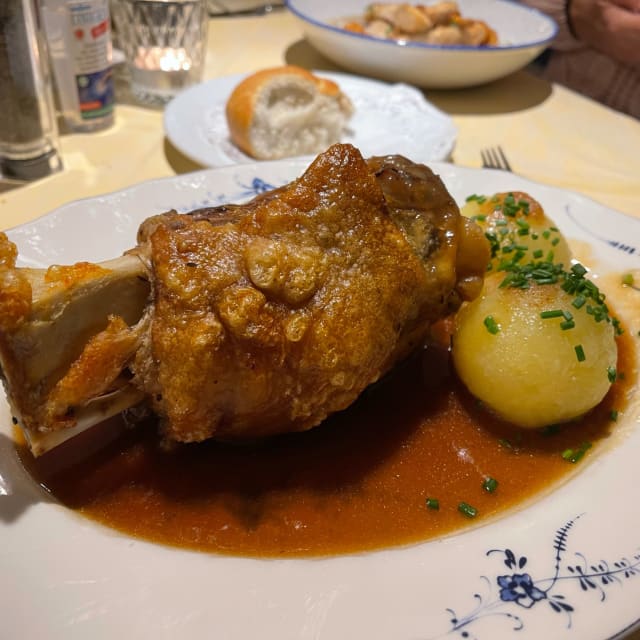
Locate an element on the screen. This screenshot has width=640, height=640. table is located at coordinates (556, 125), (157, 157), (91, 173), (244, 48), (602, 180).